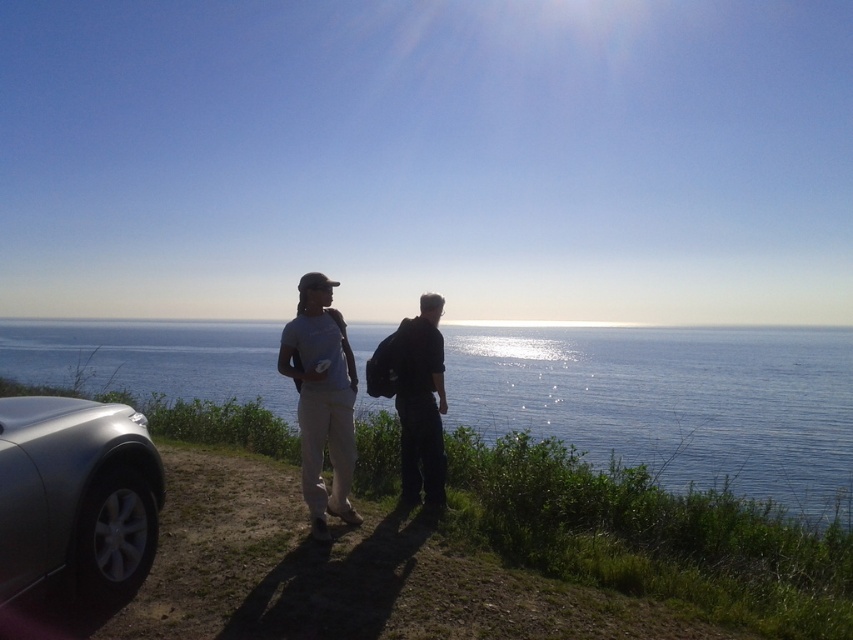
You are a photographer planning to take a picture of the silver metallic car at lower left and the black matte backpack at center. Based on their sizes in the image, which object should you focus on first if you want to ensure both are in focus without adjusting the camera settings?

The silver metallic car at lower left is not as tall as the black matte backpack at center, so you should focus on the black matte backpack at center first since it is larger and requires a closer focus distance to ensure both are in focus.

You are standing at the point marked by the coordinates point (672,401). Looking towards the cliff edge, which direction should you walk to reach the blue water at center?

The point (672,401) is already at the blue water at center, so you are already there.